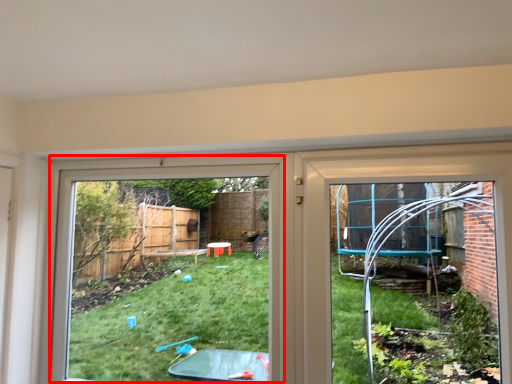
Question: Observing the image, what is the correct spatial positioning of bay window (annotated by the red box) in reference to door?

Choices:
 (A) right
 (B) left

Answer: (B)